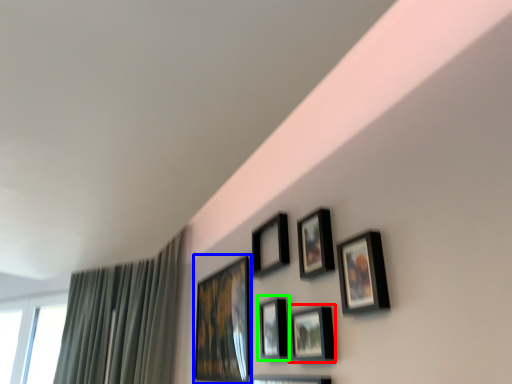
Question: Which is farther away from picture frame (highlighted by a red box)? picture frame (highlighted by a blue box) or picture frame (highlighted by a green box)?

Choices:
 (A) picture frame
 (B) picture frame

Answer: (A)